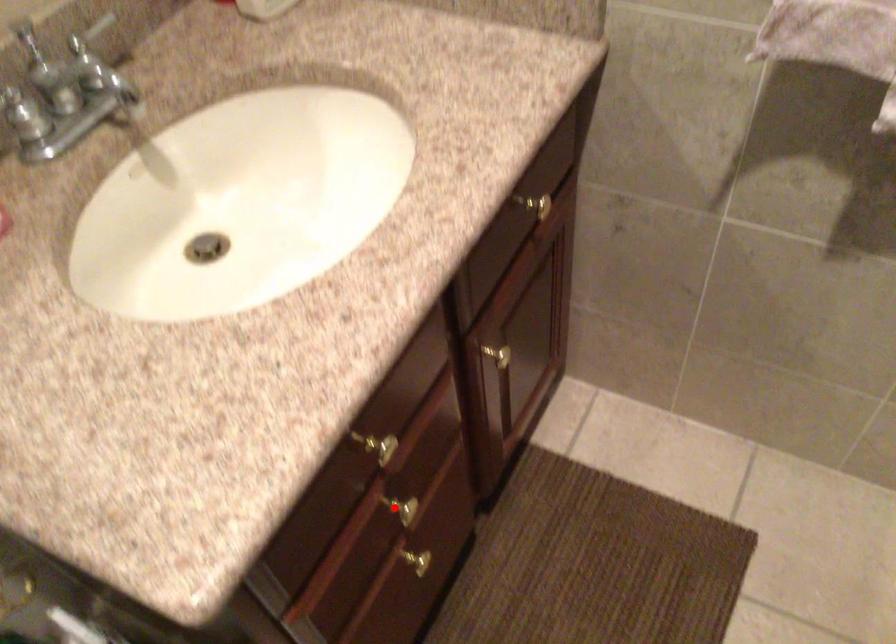
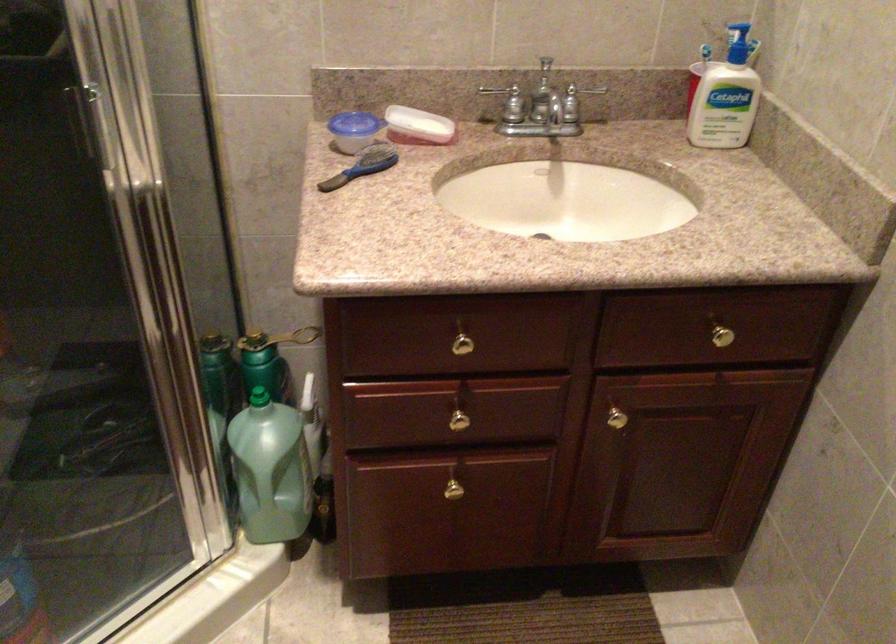
The point at the highlighted location is marked in the first image. Where is the corresponding point in the second image?

(459, 415)